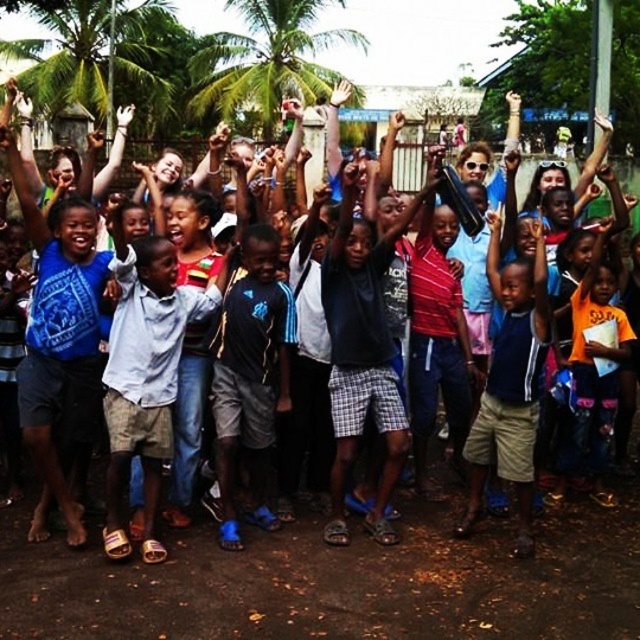
Please imagine you are standing in the center of the scene. You want to find the dark blue adidas shorts at center. Which direction should you look to locate them?

The dark blue adidas shorts at center are located at the center of the scene, so you should look straight ahead to find them.

You are a photographer trying to capture a photo of the dark blue adidas shorts at center and the green leafy palm tree at upper left. Which object should you zoom in on to make them appear the same size in the photo?

You should zoom in on the dark blue adidas shorts at center because it is thinner than the green leafy palm tree at upper left, so zooming in on it will make them appear the same size in the photo.